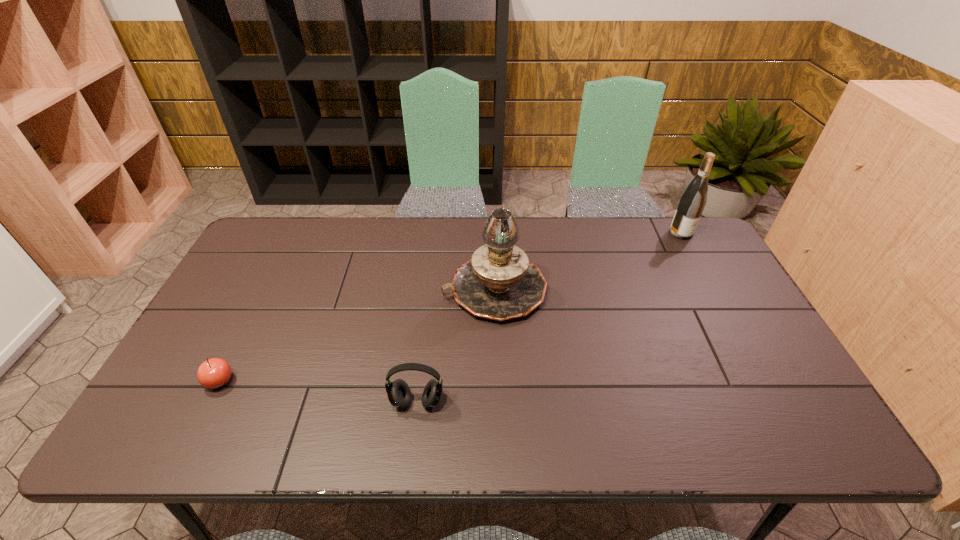
The height and width of the screenshot is (540, 960). Identify the location of oil lamp at the far edge. pos(498,282).

Locate an element on the screen. object at the near edge is located at coordinates 398,392.

At what (x,y) coordinates should I click in order to perform the action: click on object situated at the left edge. Please return your answer as a coordinate pair (x, y). This screenshot has width=960, height=540. Looking at the image, I should click on (213, 373).

Image resolution: width=960 pixels, height=540 pixels. I want to click on object that is at the right edge, so click(693, 200).

This screenshot has height=540, width=960. I want to click on object located at the far right corner, so click(693, 200).

The width and height of the screenshot is (960, 540). Identify the location of free space at the far edge. (300, 248).

Where is `vacant space at the near edge of the desktop`? Image resolution: width=960 pixels, height=540 pixels. vacant space at the near edge of the desktop is located at coordinates (226, 421).

Where is `blank space at the left edge`? The height and width of the screenshot is (540, 960). blank space at the left edge is located at coordinates (252, 327).

Locate an element on the screen. This screenshot has height=540, width=960. vacant space at the right edge of the desktop is located at coordinates (776, 385).

This screenshot has width=960, height=540. I want to click on vacant region at the far left corner of the desktop, so click(x=287, y=237).